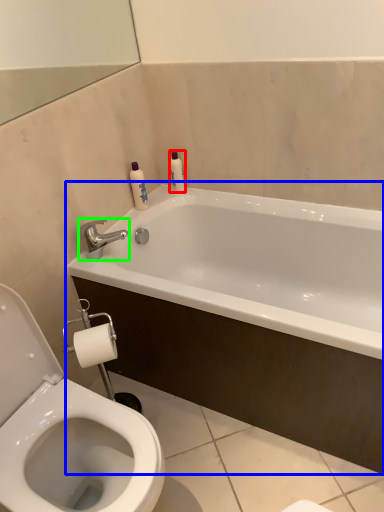
Question: Estimate the real-world distances between objects in this image. Which object is closer to toiletry (highlighted by a red box), bathtub (highlighted by a blue box) or tap (highlighted by a green box)?

Choices:
 (A) bathtub
 (B) tap

Answer: (B)